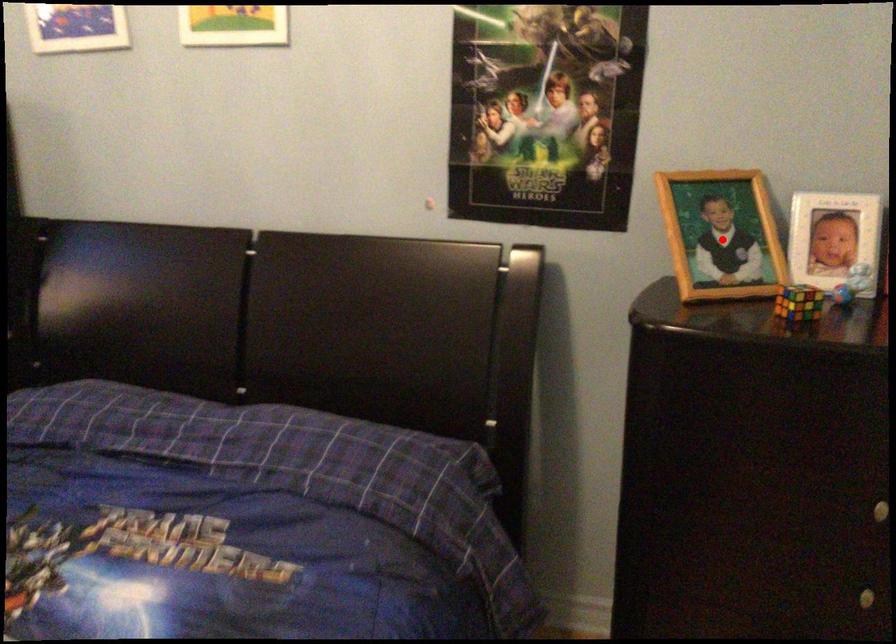
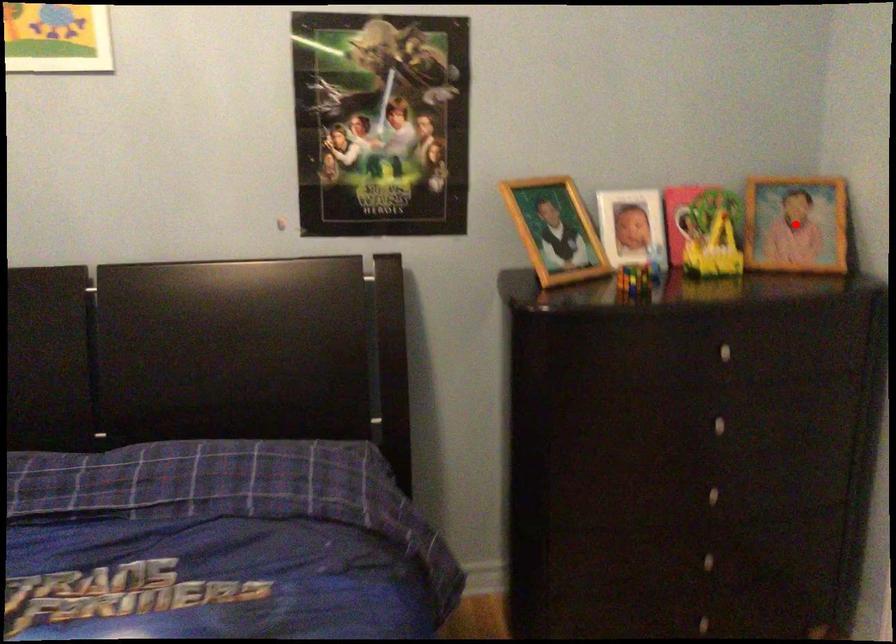
I am providing you with two images of the same scene from different viewpoints. A red point is marked on the first image and another point is marked on the second image. Does the point marked in image1 correspond to the same location as the one in image2?

No